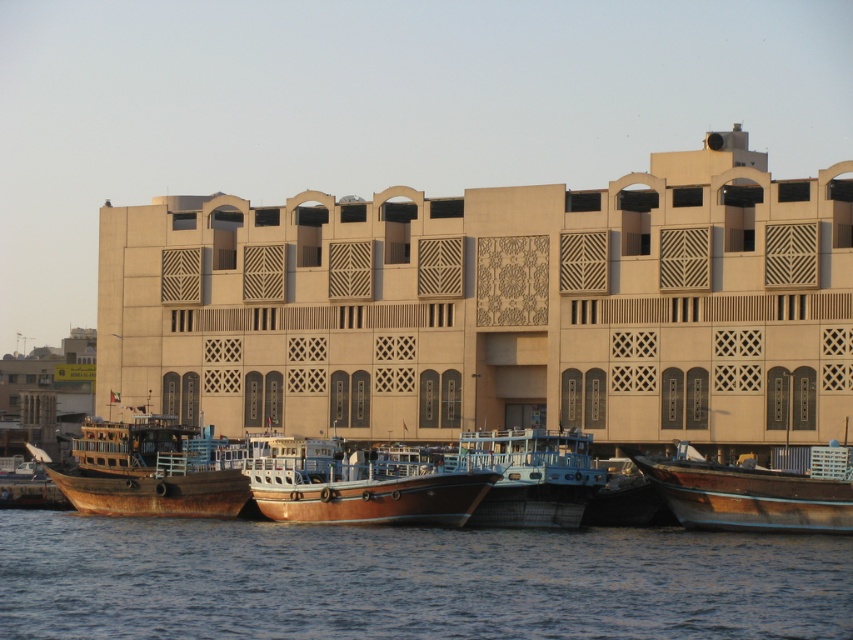
You are standing on the dock and see a point marked at coordinates (357, 484). Which object is this point located on?

The point at coordinates (357, 484) is located on the wooden polished boat at center.

You are standing at the waterfront and looking at the beige building. There are two points marked on the building facade. One is at point coordinate point (83, 481) and the other is at point coordinate point (697, 492). Which point is closer to you?

Point (83, 481) is further to the camera than point (697, 492), so the point closer to you is point (697, 492).